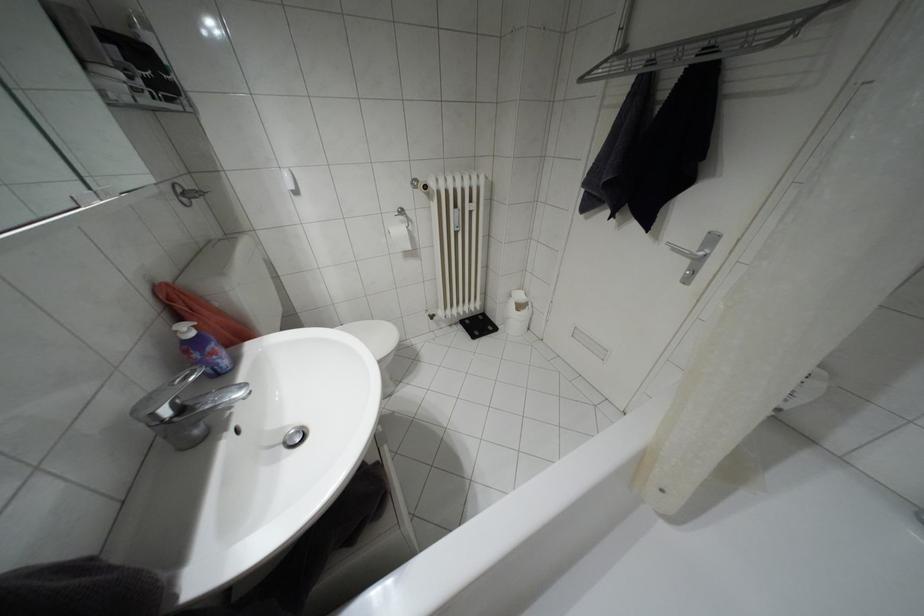
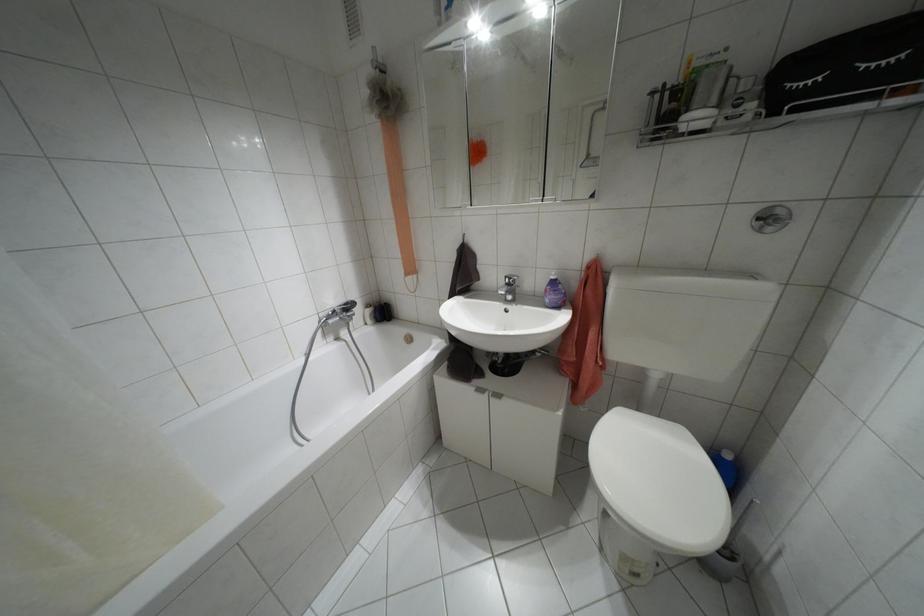
Find the pixel in the second image that matches (x=180, y=408) in the first image.

(507, 284)